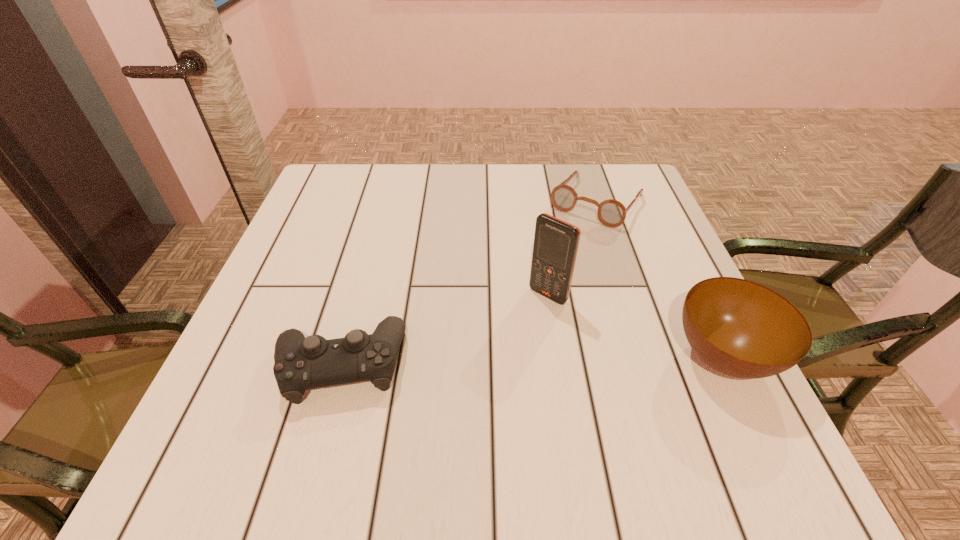
Image resolution: width=960 pixels, height=540 pixels. Identify the location of spectacles at the right edge. (611, 213).

Image resolution: width=960 pixels, height=540 pixels. I want to click on object located at the near left corner, so click(x=301, y=363).

What are the coordinates of `object that is at the far right corner` in the screenshot? It's located at (611, 213).

At what (x,y) coordinates should I click in order to perform the action: click on object located in the near right corner section of the desktop. Please return your answer as a coordinate pair (x, y). Looking at the image, I should click on (740, 328).

Where is `free point at the far edge`? The width and height of the screenshot is (960, 540). free point at the far edge is located at coordinates (501, 189).

Where is `vacant space at the near edge of the desktop`? vacant space at the near edge of the desktop is located at coordinates point(545,399).

In the image, there is a desktop. At what (x,y) coordinates should I click in order to perform the action: click on blank space at the left edge. Please return your answer as a coordinate pair (x, y). Image resolution: width=960 pixels, height=540 pixels. Looking at the image, I should click on (319, 272).

Find the location of `vacant space at the right edge of the desktop`. vacant space at the right edge of the desktop is located at coordinates (671, 341).

Identify the location of vacant space at the far left corner of the desktop. The image size is (960, 540). (348, 209).

Image resolution: width=960 pixels, height=540 pixels. I want to click on vacant space at the far right corner of the desktop, so click(586, 179).